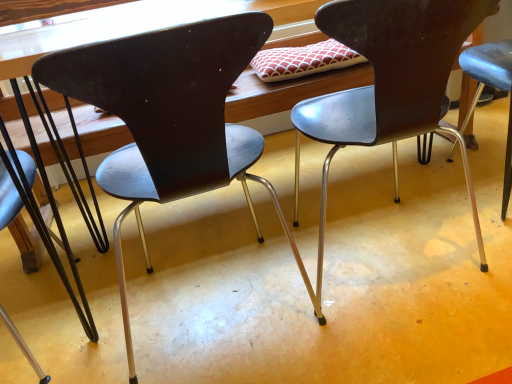
Where is `vacant region below matte black chair at center, the second chair viewed from the right (from a real-world perspective)`? vacant region below matte black chair at center, the second chair viewed from the right (from a real-world perspective) is located at coordinates (217, 295).